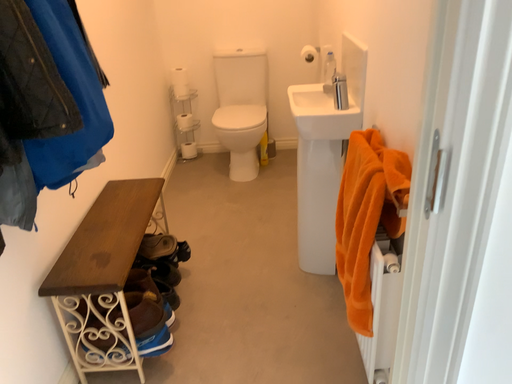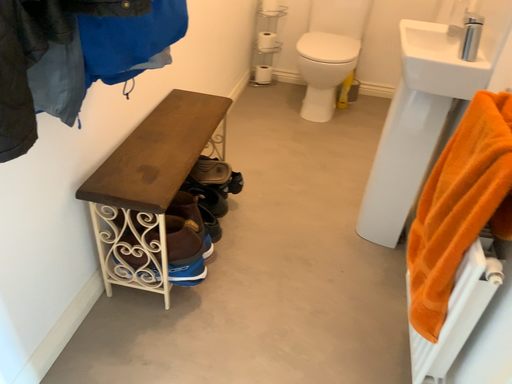
Question: Which way did the camera rotate in the video?

Choices:
 (A) rotated right
 (B) rotated left

Answer: (B)